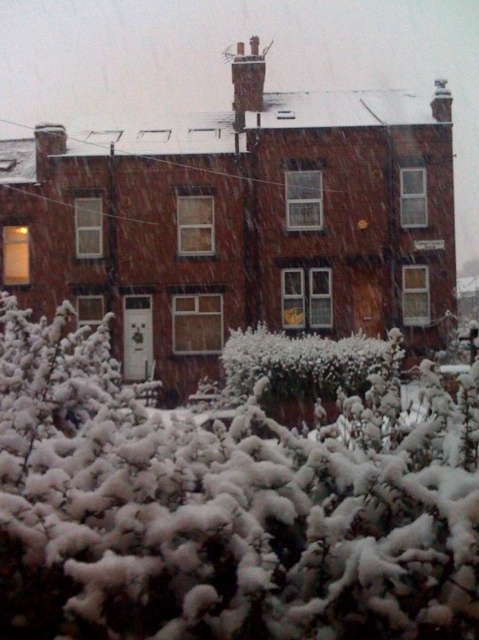
Does white fluffy bush at lower center come behind white fluffy bush at center?

No, white fluffy bush at lower center is in front of white fluffy bush at center.

Does white fluffy bush at lower center have a greater width compared to white fluffy bush at center?

Yes.

Between point (213, 577) and point (312, 358), which one is positioned behind?

Point (312, 358)

The image size is (479, 640). Find the location of `white fluffy bush at lower center`. white fluffy bush at lower center is located at coordinates (228, 504).